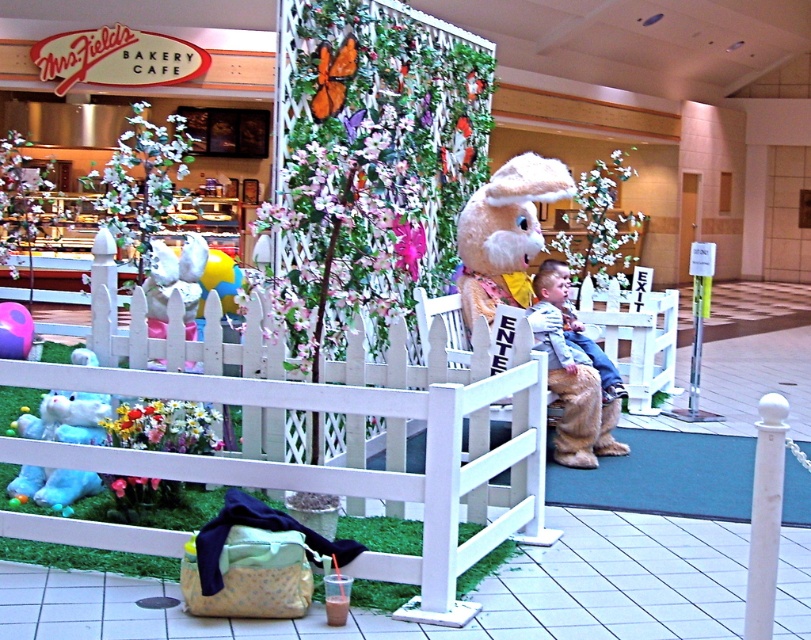
You are standing in the shopping mall and want to take a photo of the fluffy beige bunny at center. The mall has a rule that photos must be taken from a distance of at least 1 meter away from the bunny. If you position yourself directly in front of the bunny, will you be able to comply with the rule?

The question cannot be answered with the provided information because the 2D coordinates of the fluffy beige bunny at center do not provide information about the actual distance required to comply with the mall rule.

You are standing at the entrance of the mall and see two points marked in the scene. The first point is at coordinates point [486,305] and the second is at point [569,288]. Which point is closer to you?

Point [486,305] is in front of point [569,288], so it is closer to you.

You are a photographer trying to capture the fluffy beige bunny at center and the light blue denim jeans at center in the same frame. Based on their positions, which object is closer to the left edge of the photo?

The fluffy beige bunny at center is positioned on the left side of light blue denim jeans at center, so it is closer to the left edge of the photo.